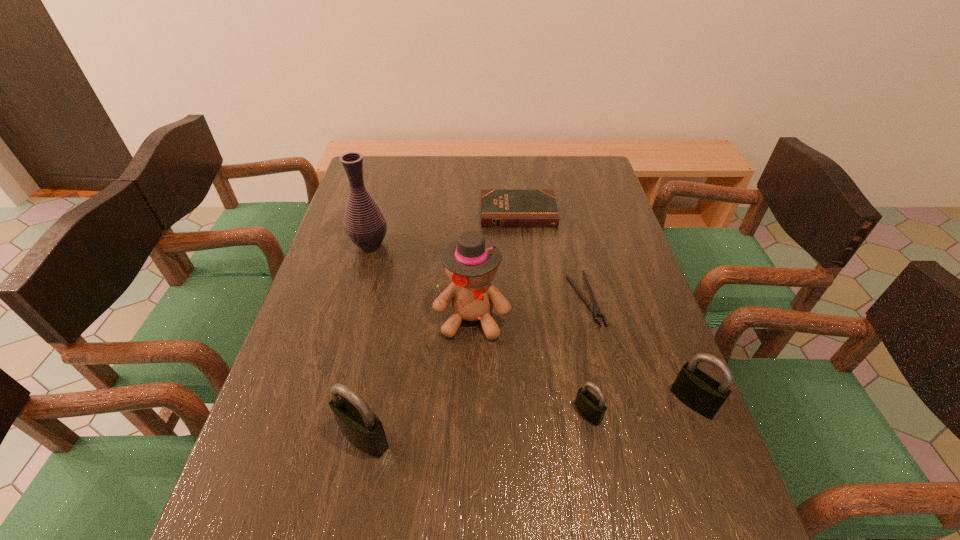
You are a GUI agent. You are given a task and a screenshot of the screen. Output one action in this format:
    pyautogui.click(x=<x>, y=<y>)
    Task: Click on the sixth shortest object
    
    Given the screenshot: What is the action you would take?
    pyautogui.click(x=471, y=264)

Where is `vacant space located 0.200m on the back of the leftmost padlock`? vacant space located 0.200m on the back of the leftmost padlock is located at coordinates (383, 342).

At what (x,y) coordinates should I click in order to perform the action: click on vacant space located on the left of the third shortest object. Please return your answer as a coordinate pair (x, y). Looking at the image, I should click on (461, 413).

In order to click on free point located 0.380m on the left of the fourth shortest object in this screenshot , I will do `click(496, 401)`.

Identify the location of free point located 0.270m on the front of the Bible. (526, 290).

The height and width of the screenshot is (540, 960). I want to click on free space located on the front of the tongs, so click(626, 473).

Where is `vacant space situated 0.090m on the right of the vase`? vacant space situated 0.090m on the right of the vase is located at coordinates (420, 245).

Locate an element on the screen. free location located 0.120m on the front-facing side of the rag_doll is located at coordinates (471, 387).

At what (x,y) coordinates should I click in order to perform the action: click on object located at the near edge. Please return your answer as a coordinate pair (x, y). Looking at the image, I should click on (360, 426).

This screenshot has width=960, height=540. What are the coordinates of `padlock present at the left edge` in the screenshot? It's located at (360, 426).